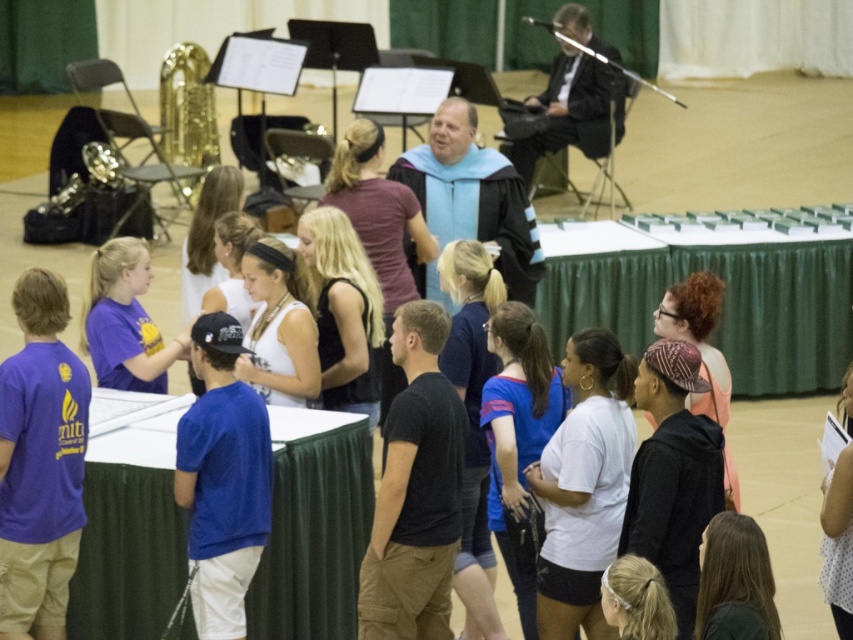
You are standing at the back of the gymnasium and want to take a photo of both the point at coordinates point (560, 44) and point (187, 106). Which point should you focus on first to ensure both are in focus?

You should focus on point (560, 44) first because it is closer to you than point (187, 106), ensuring both will be in focus when focused on the closer point.

You are standing at the entrance of the gymnasium and see the point marked at coordinates [572,112]. Which object does this point belong to?

The point at [572,112] is on the black suit at upper right.

You are standing in the gymnasium and want to reach a specific point marked at coordinates point (444, 125). If your current position is 30 feet away from that point, can you walk straight to it without any obstacles?

The distance of point (444, 125) from viewer is 37.89 feet. Since you are currently 30 feet away from it, you need to walk an additional 7.89 feet to reach the point. Assuming there are no obstacles in your path, you can proceed straight.